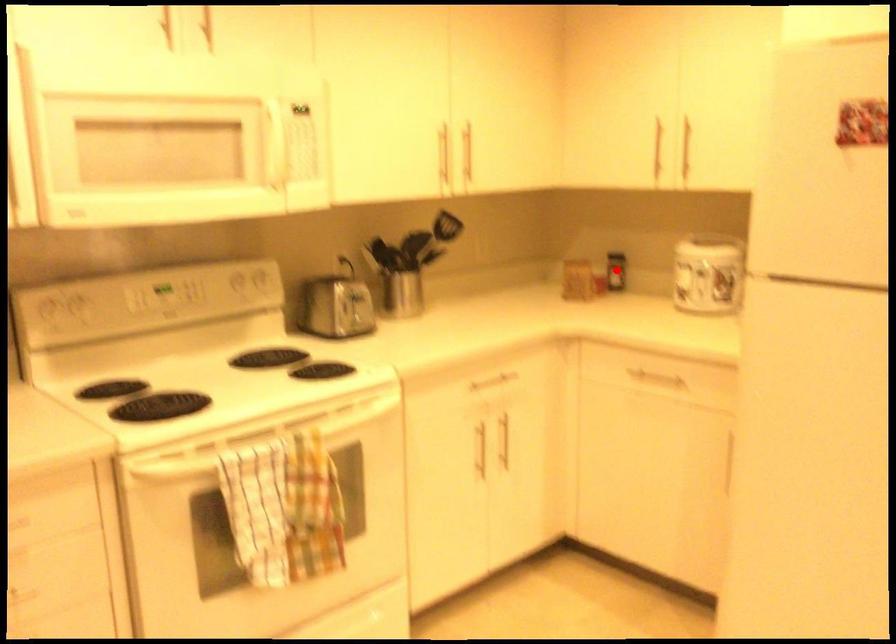
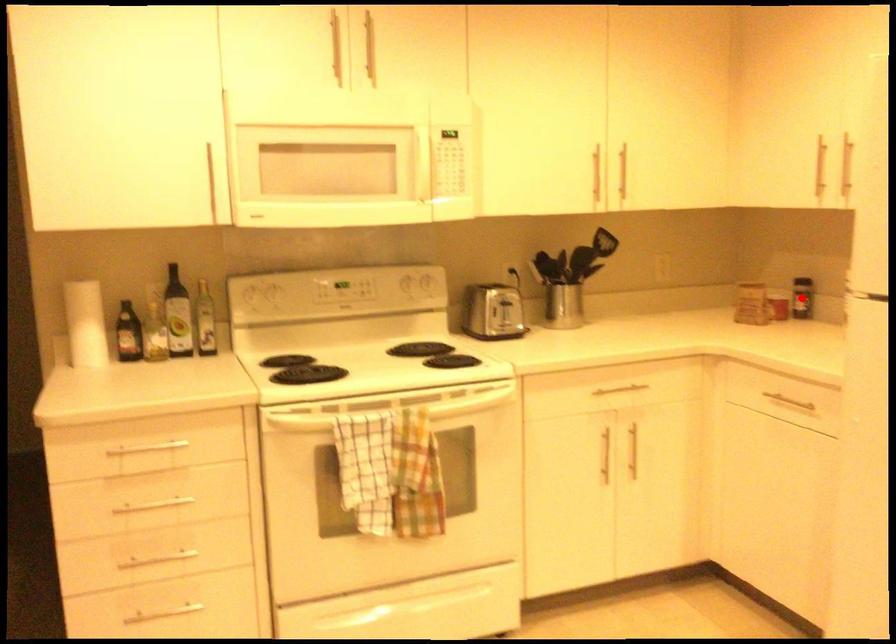
I am providing you with two images of the same scene from different viewpoints. A red point is marked on the first image and another point is marked on the second image. Does the point marked in image1 correspond to the same location as the one in image2?

Yes